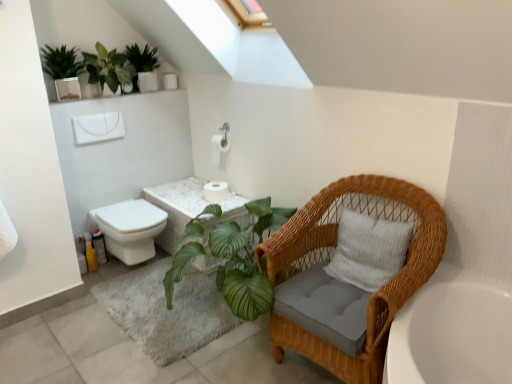
Question: Which direction should I rotate to look at white matte toilet paper at center, the 1th toilet paper positioned from the top?

Choices:
 (A) right
 (B) left

Answer: (B)

Question: Does green leafy plant at upper left, marked as the 2th houseplant in a right-to-left arrangement, appear on the left side of green matte plant at upper left, which ranks as the 1th houseplant in left-to-right order?

Choices:
 (A) no
 (B) yes

Answer: (A)

Question: Is green matte plant at upper left, which ranks as the 1th houseplant in left-to-right order, surrounded by green leafy plant at upper left, marked as the 2th houseplant in a right-to-left arrangement?

Choices:
 (A) no
 (B) yes

Answer: (A)

Question: Can you confirm if green leafy plant at upper left, placed as the second houseplant when sorted from left to right, is shorter than green matte plant at upper left, which ranks as the 1th houseplant in left-to-right order?

Choices:
 (A) yes
 (B) no

Answer: (A)

Question: Is green leafy plant at upper left, placed as the second houseplant when sorted from left to right, far from green matte plant at upper left, which ranks as the 1th houseplant in left-to-right order?

Choices:
 (A) yes
 (B) no

Answer: (B)

Question: From a real-world perspective, is green leafy plant at upper left, placed as the second houseplant when sorted from left to right, over green matte plant at upper left, which ranks as the 3th houseplant in right-to-left order?

Choices:
 (A) yes
 (B) no

Answer: (B)

Question: Is green leafy plant at upper left, placed as the second houseplant when sorted from left to right, closer to the viewer compared to green matte plant at upper left, which ranks as the 1th houseplant in left-to-right order?

Choices:
 (A) no
 (B) yes

Answer: (A)

Question: Considering the relative positions of white matte toilet paper at center, the 1th toilet paper positioned from the top, and green leafy plant at upper left, placed as the second houseplant when sorted from left to right, in the image provided, is white matte toilet paper at center, the 1th toilet paper positioned from the top, to the right of green leafy plant at upper left, placed as the second houseplant when sorted from left to right, from the viewer's perspective?

Choices:
 (A) yes
 (B) no

Answer: (A)

Question: Considering the relative sizes of white matte toilet paper at center, the 1th toilet paper positioned from the top, and green leafy plant at upper left, marked as the 2th houseplant in a right-to-left arrangement, in the image provided, is white matte toilet paper at center, the 1th toilet paper positioned from the top, thinner than green leafy plant at upper left, marked as the 2th houseplant in a right-to-left arrangement,?

Choices:
 (A) no
 (B) yes

Answer: (B)

Question: Is white matte toilet paper at center, which is counted as the 2th toilet paper, starting from the bottom, next to green leafy plant at upper left, marked as the 2th houseplant in a right-to-left arrangement?

Choices:
 (A) yes
 (B) no

Answer: (B)

Question: Is white matte toilet paper at center, the 1th toilet paper positioned from the top, surrounding green leafy plant at upper left, placed as the second houseplant when sorted from left to right?

Choices:
 (A) yes
 (B) no

Answer: (B)

Question: Does white matte toilet paper at center, the 1th toilet paper positioned from the top, have a lesser height compared to green leafy plant at upper left, marked as the 2th houseplant in a right-to-left arrangement?

Choices:
 (A) yes
 (B) no

Answer: (A)

Question: Is the position of white matte toilet paper at center, which is counted as the 2th toilet paper, starting from the bottom, less distant than that of green leafy plant at upper left, placed as the second houseplant when sorted from left to right?

Choices:
 (A) yes
 (B) no

Answer: (B)

Question: Does woven wicker chair at right have a larger size compared to white wicker vanity at center?

Choices:
 (A) yes
 (B) no

Answer: (A)